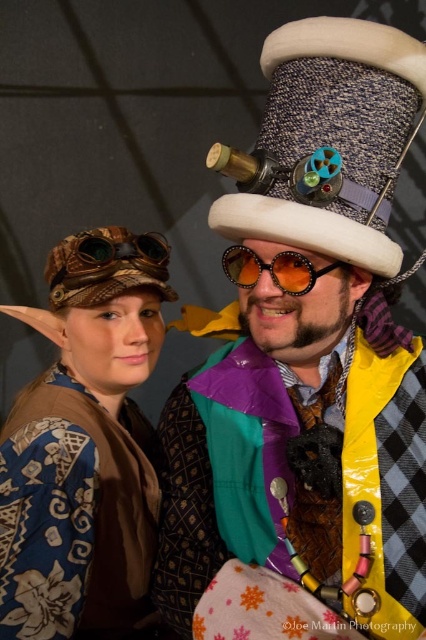
Question: Which object appears farthest from the camera in this image?

Choices:
 (A) speckled fabric dress hat at upper center
 (B) blue fabric hat at upper left
 (C) shiny orange sunglasses at center

Answer: (B)

Question: Does blue fabric hat at upper left come behind steampunk brass goggles at upper left?

Choices:
 (A) no
 (B) yes

Answer: (A)

Question: Among these points, which one is farthest from the camera?

Choices:
 (A) pos(294,268)
 (B) pos(282,147)

Answer: (B)

Question: Is blue fabric hat at upper left above speckled fabric dress hat at upper center?

Choices:
 (A) yes
 (B) no

Answer: (B)

Question: Which object is the farthest from the speckled fabric dress hat at upper center?

Choices:
 (A) steampunk brass goggles at upper left
 (B) blue fabric hat at upper left
 (C) steampunk hat at center

Answer: (B)

Question: Observing the image, what is the correct spatial positioning of steampunk hat at center in reference to steampunk brass goggles at upper left?

Choices:
 (A) right
 (B) left

Answer: (A)